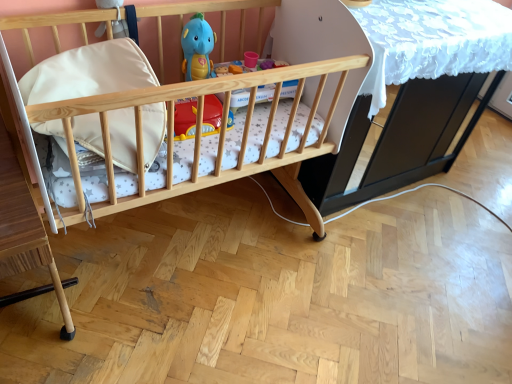
Question: From a real-world perspective, is natural wood crib at center physically located above or below white leather pillow at center?

Choices:
 (A) above
 (B) below

Answer: (B)

Question: In terms of height, does natural wood crib at center look taller or shorter compared to white leather pillow at center?

Choices:
 (A) short
 (B) tall

Answer: (B)

Question: Which of these objects is positioned closest to the natural wood crib at center?

Choices:
 (A) white lace table at center
 (B) matte blue plush toy at upper center
 (C) white leather pillow at center

Answer: (C)

Question: Which of these objects is positioned farthest from the white lace table at center?

Choices:
 (A) natural wood crib at center
 (B) white leather pillow at center
 (C) matte blue plush toy at upper center

Answer: (B)